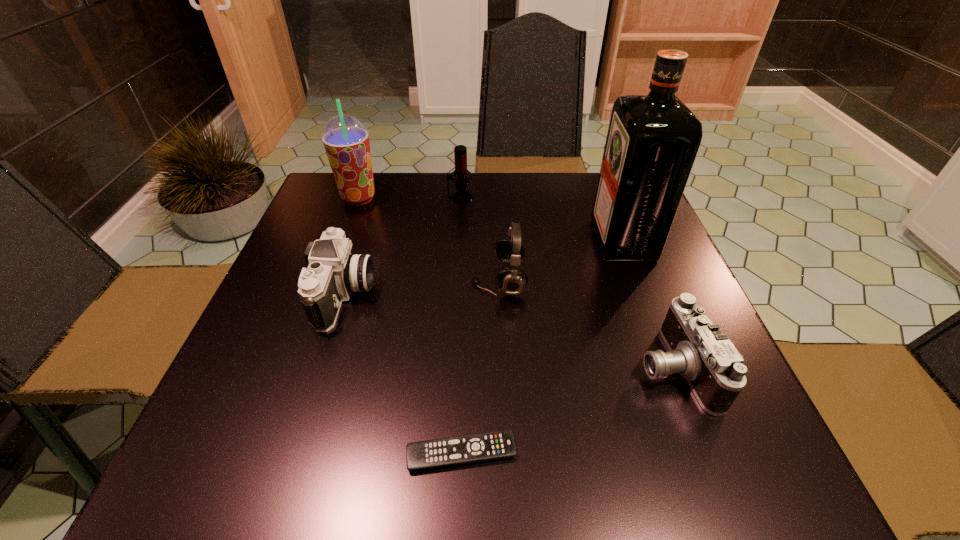
I want to click on the tallest object, so click(x=652, y=141).

At what (x,y) coordinates should I click in order to perform the action: click on smoothie. Please return your answer as a coordinate pair (x, y). This screenshot has width=960, height=540. Looking at the image, I should click on (346, 140).

At what (x,y) coordinates should I click in order to perform the action: click on microphone. Please return your answer as a coordinate pair (x, y). The width and height of the screenshot is (960, 540). Looking at the image, I should click on (460, 151).

The image size is (960, 540). I want to click on headset, so click(x=510, y=250).

Find the location of a particular element. The image size is (960, 540). the taller camera is located at coordinates (333, 273).

This screenshot has width=960, height=540. Identify the location of the second shortest object. (698, 349).

Find the location of a particular element. the shorter camera is located at coordinates [698, 349].

This screenshot has width=960, height=540. In order to click on remote control in this screenshot , I will do `click(450, 451)`.

Image resolution: width=960 pixels, height=540 pixels. Identify the location of the nearest object. (450, 451).

Where is `free space located on the front label of the liquor`? free space located on the front label of the liquor is located at coordinates (513, 240).